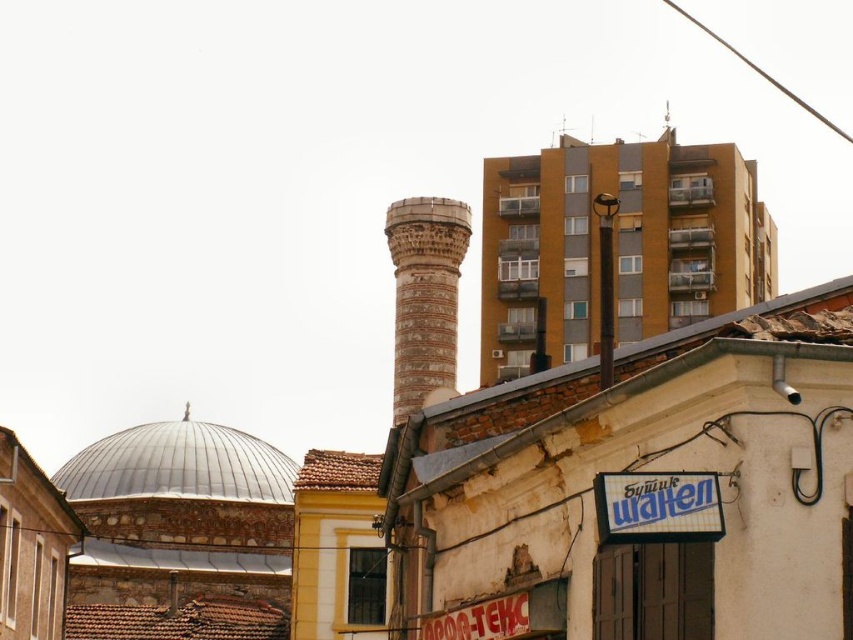
Question: Which object appears farthest from the camera in this image?

Choices:
 (A) brown stone tower at center
 (B) white plastic sign at lower right

Answer: (A)

Question: Is brown stone tower at center bigger than white plastic sign at lower right?

Choices:
 (A) yes
 (B) no

Answer: (A)

Question: Which of the following is the closest to the observer?

Choices:
 (A) brown stone tower at center
 (B) white plastic sign at lower right
 (C) metallic wire at upper right

Answer: (B)

Question: Is brown stone tower at center to the right of white plastic sign at lower right from the viewer's perspective?

Choices:
 (A) no
 (B) yes

Answer: (A)

Question: Among these objects, which one is nearest to the camera?

Choices:
 (A) metallic wire at upper right
 (B) white plastic sign at lower right
 (C) brown stone tower at center

Answer: (B)

Question: Does white plastic sign at lower right have a larger size compared to metallic wire at upper right?

Choices:
 (A) no
 (B) yes

Answer: (A)